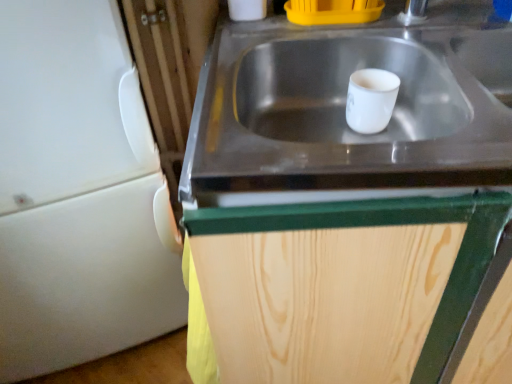
This screenshot has height=384, width=512. Describe the element at coordinates (78, 194) in the screenshot. I see `white matte refrigerator at left` at that location.

The image size is (512, 384). Describe the element at coordinates (371, 100) in the screenshot. I see `white glossy mug at center` at that location.

Find the location of a particular element. The height and width of the screenshot is (384, 512). white matte refrigerator at left is located at coordinates (78, 194).

In terms of height, does white matte refrigerator at left look taller or shorter compared to wooden cabinet at center?

In the image, white matte refrigerator at left appears to be taller than wooden cabinet at center.

Is wooden cabinet at center at the back of white matte refrigerator at left?

No.

Visually, is white matte refrigerator at left positioned to the left or to the right of wooden cabinet at center?

white matte refrigerator at left is positioned on wooden cabinet at center's left side.

Is stainless steel sink at center to the right of wooden cabinet at center from the viewer's perspective?

No.

Is stainless steel sink at center beside wooden cabinet at center?

There is a gap between stainless steel sink at center and wooden cabinet at center.

Is stainless steel sink at center outside of wooden cabinet at center?

No, most part of stainless steel sink at center lies within wooden cabinet at center.

Considering the sizes of objects stainless steel sink at center and wooden cabinet at center in the image provided, who is bigger, stainless steel sink at center or wooden cabinet at center?

wooden cabinet at center.

Are white matte refrigerator at left and white glossy mug at center beside each other?

white matte refrigerator at left and white glossy mug at center are clearly separated.

How different are the orientations of white matte refrigerator at left and white glossy mug at center in degrees?

The facing directions of white matte refrigerator at left and white glossy mug at center are 20 degrees apart.

Is white matte refrigerator at left not inside white glossy mug at center?

white matte refrigerator at left is positioned outside white glossy mug at center.

Where is `appliance below the white glossy mug at center (from the image's perspective)`? This screenshot has height=384, width=512. appliance below the white glossy mug at center (from the image's perspective) is located at coordinates (78, 194).

Is wooden cabinet at center turned away from white glossy mug at center?

wooden cabinet at center is not turned away from white glossy mug at center.

Is wooden cabinet at center at the right side of white glossy mug at center?

Yes, wooden cabinet at center is to the right of white glossy mug at center.

Would you say wooden cabinet at center contains white glossy mug at center?

Yes, white glossy mug at center can be found within wooden cabinet at center.

From the image's perspective, which is below, wooden cabinet at center or white glossy mug at center?

wooden cabinet at center appears lower in the image.

Does white matte refrigerator at left appear on the right side of stainless steel sink at center?

No, white matte refrigerator at left is not to the right of stainless steel sink at center.

Considering the points (0, 66) and (211, 138), which point is in front, point (0, 66) or point (211, 138)?

Point (211, 138)

Is white matte refrigerator at left taller than stainless steel sink at center?

Yes.

From the image's perspective, between white glossy mug at center and white matte refrigerator at left, which one is located above?

white glossy mug at center, from the image's perspective.

Visually, is white glossy mug at center positioned to the left or to the right of white matte refrigerator at left?

white glossy mug at center is positioned on white matte refrigerator at left's right side.

Is white glossy mug at center wider than white matte refrigerator at left?

No, white glossy mug at center is not wider than white matte refrigerator at left.

Would you say white glossy mug at center is inside or outside stainless steel sink at center?

white glossy mug at center can be found inside stainless steel sink at center.

Which is in front, white glossy mug at center or stainless steel sink at center?

stainless steel sink at center is more forward.

Does white glossy mug at center turn towards stainless steel sink at center?

Yes, white glossy mug at center is facing stainless steel sink at center.

From the image's perspective, is white glossy mug at center over stainless steel sink at center?

Yes, from the image's perspective, white glossy mug at center is on top of stainless steel sink at center.

The width and height of the screenshot is (512, 384). Find the location of `appliance that is behind the wooden cabinet at center`. appliance that is behind the wooden cabinet at center is located at coordinates (78, 194).

Locate an element on the screen. The image size is (512, 384). sink above the wooden cabinet at center (from the image's perspective) is located at coordinates (344, 107).

Estimate the real-world distances between objects in this image. Which object is closer to white glossy mug at center, stainless steel sink at center or wooden cabinet at center?

Based on the image, stainless steel sink at center appears to be nearer to white glossy mug at center.

When comparing their distances from white matte refrigerator at left, does white glossy mug at center or stainless steel sink at center seem closer?

The object closer to white matte refrigerator at left is stainless steel sink at center.

Estimate the real-world distances between objects in this image. Which object is closer to white matte refrigerator at left, stainless steel sink at center or wooden cabinet at center?

Based on the image, stainless steel sink at center appears to be nearer to white matte refrigerator at left.

Estimate the real-world distances between objects in this image. Which object is further from stainless steel sink at center, white glossy mug at center or wooden cabinet at center?

wooden cabinet at center.

Which object lies further to the anchor point white matte refrigerator at left, wooden cabinet at center or white glossy mug at center?

white glossy mug at center is positioned further to the anchor white matte refrigerator at left.

From the image, which object appears to be nearer to white matte refrigerator at left, white glossy mug at center or wooden cabinet at center?

wooden cabinet at center.

Based on their spatial positions, is white matte refrigerator at left or white glossy mug at center closer to stainless steel sink at center?

white glossy mug at center is positioned closer to the anchor stainless steel sink at center.

Considering their positions, is white matte refrigerator at left positioned further to white glossy mug at center than wooden cabinet at center?

white matte refrigerator at left is positioned further to the anchor white glossy mug at center.

At what (x,y) coordinates should I click in order to perform the action: click on cabinetry between stainless steel sink at center and white glossy mug at center from front to back. Please return your answer as a coordinate pair (x, y). The height and width of the screenshot is (384, 512). Looking at the image, I should click on (359, 289).

What are the coordinates of `mug between white matte refrigerator at left and wooden cabinet at center` in the screenshot? It's located at (371, 100).

Locate an element on the screen. The height and width of the screenshot is (384, 512). sink situated between white matte refrigerator at left and wooden cabinet at center from left to right is located at coordinates (344, 107).

This screenshot has width=512, height=384. In order to click on mug between white matte refrigerator at left and stainless steel sink at center in the horizontal direction in this screenshot , I will do `click(371, 100)`.